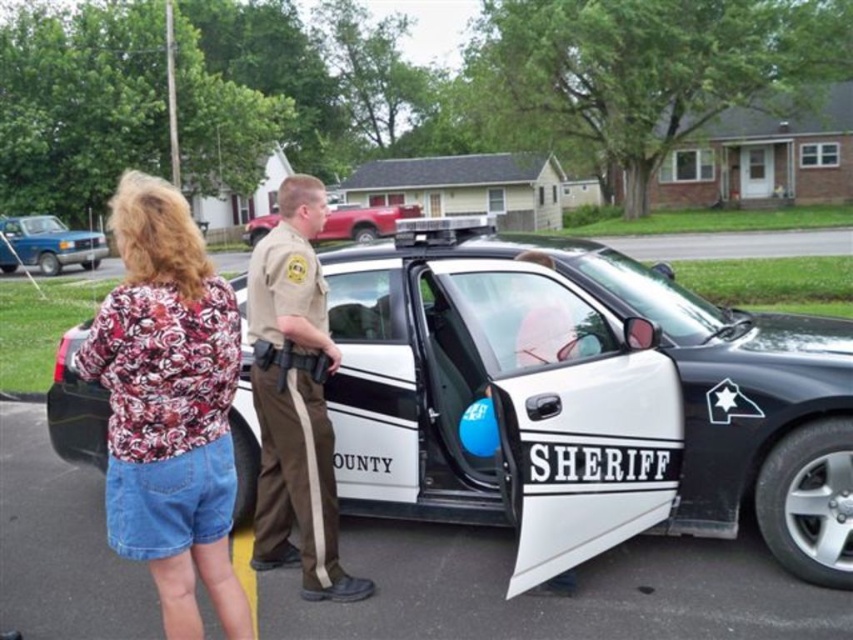
You are a witness to this scene and need to report the location of the white glossy sheriff car at center relative to the tan uniform at center. Which is lower in the image?

The white glossy sheriff car at center is located below the tan uniform at center, so the car is lower in the image.

You are a delivery person trying to park your van next to the white glossy sheriff car at center and the floral fabric blouse at upper left. Which object should you avoid hitting because it is narrower?

The white glossy sheriff car at center is thinner than the floral fabric blouse at upper left, so you should avoid hitting the white glossy sheriff car at center to prevent damage since it is narrower.